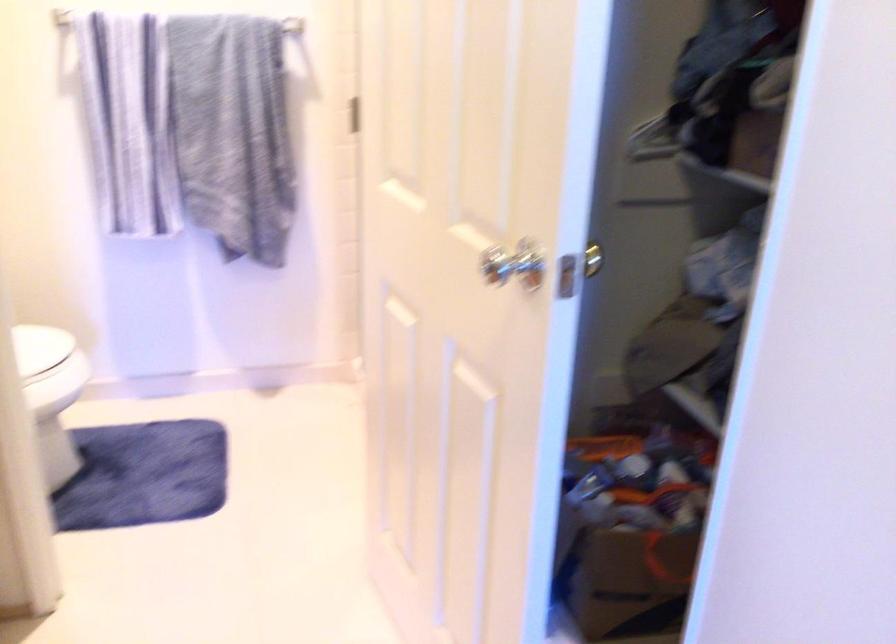
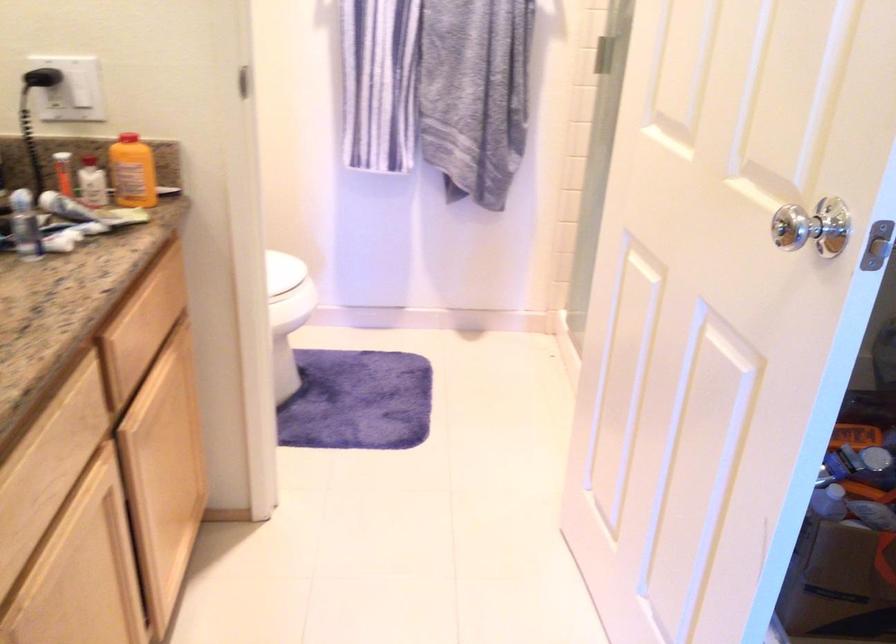
Question: The images are taken continuously from a first-person perspective. In which direction is your viewpoint rotating?

Choices:
 (A) Left
 (B) Right
 (C) Up
 (D) Down

Answer: (A)